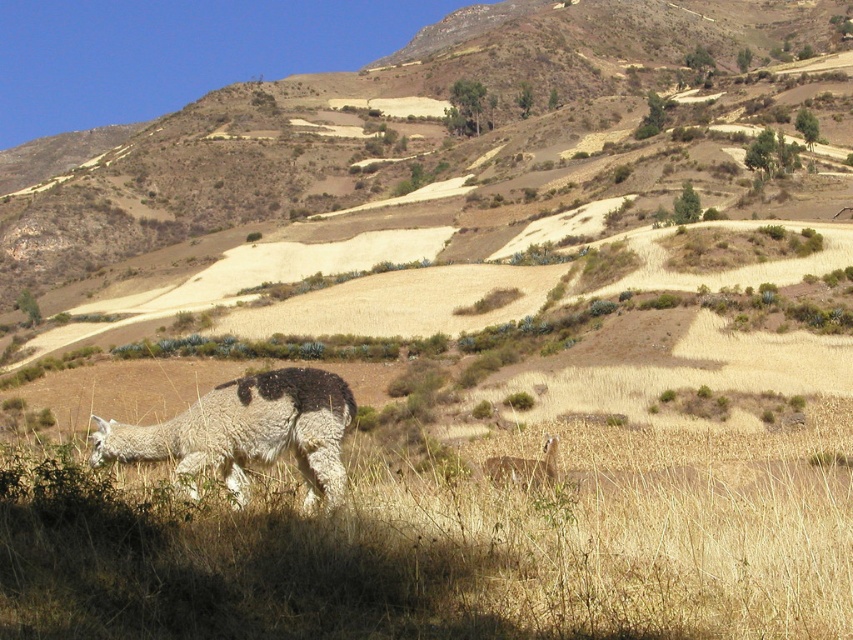
Does point (180, 476) come farther from viewer compared to point (482, 467)?

No, it is in front of (482, 467).

Which of these two, fuzzy white alpaca at lower left or fuzzy white alpaca at center, stands taller?

fuzzy white alpaca at center is taller.

Is point (111, 424) closer to camera compared to point (509, 465)?

Yes, it is in front of point (509, 465).

Find the location of `fuzzy white alpaca at lower left`. fuzzy white alpaca at lower left is located at coordinates (247, 432).